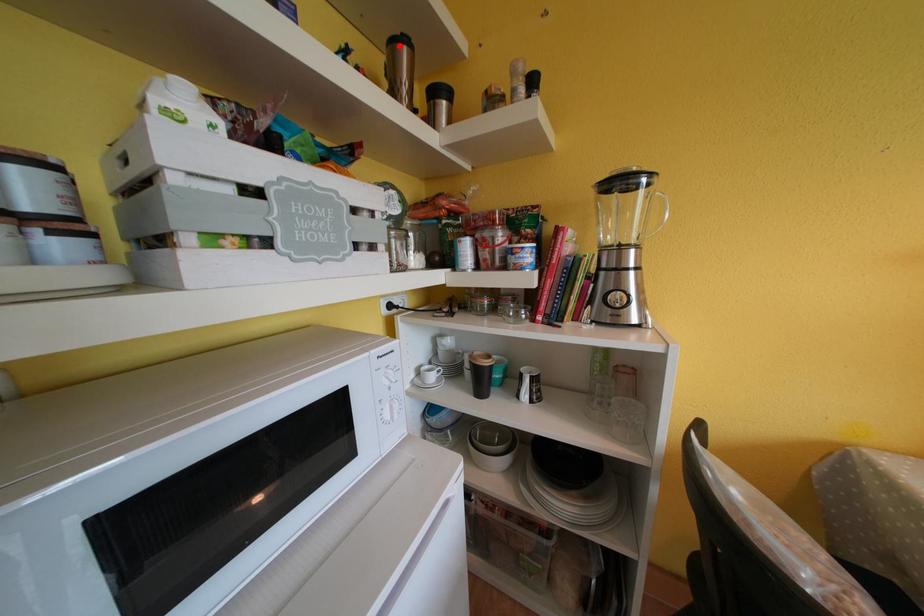
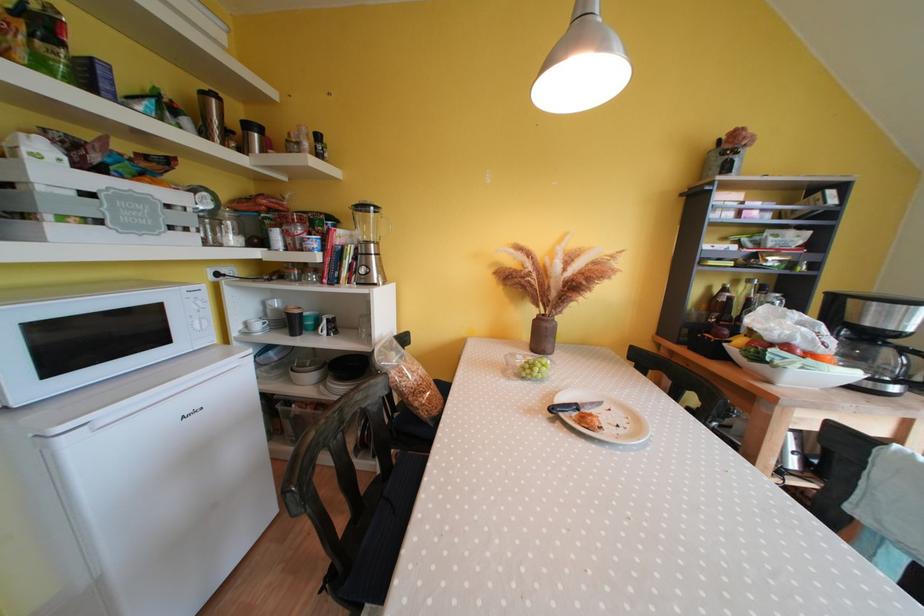
Where in the second image is the point corresponding to the highlighted location from the first image?

(209, 98)